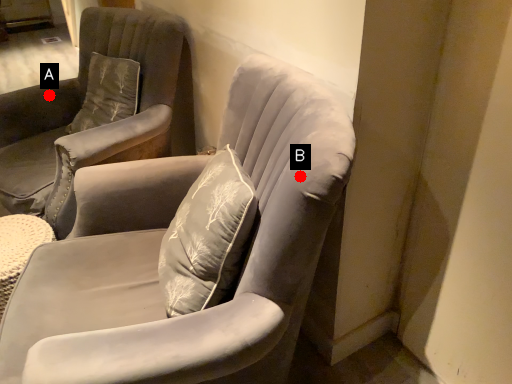
Question: Two points are circled on the image, labeled by A and B beside each circle. Which of the following is the farthest from the observer?

Choices:
 (A) A is further
 (B) B is further

Answer: (A)